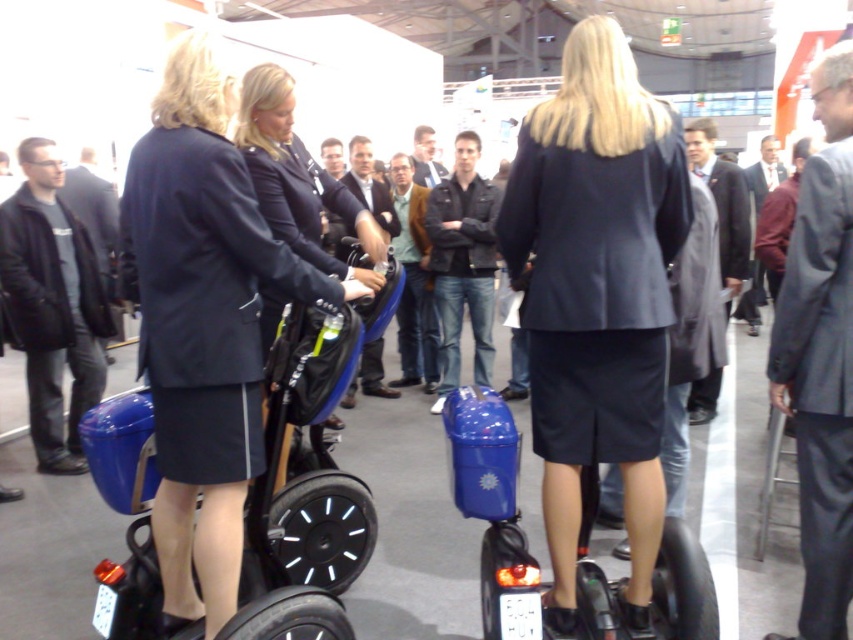
You are a photographer positioned in the front row of the exhibition hall. You want to take a photo that includes both the black matte jacket at left and the matte black segway at center. Which object should you focus on first to ensure both are in sharp focus?

The black matte jacket at left is closer to you than the matte black segway at center. To ensure both are in focus, focus on the black matte jacket at left first, as it is the closer object, and the segway will fall within the depth of field.

You are a delivery robot with a 30 inch wide package. You need to move from the blue matte scooter at center to the matte black jacket at center. Can you fit through the space between them?

The distance between the blue matte scooter at center and matte black jacket at center is 32.09 inches. Since your package is 30 inches wide, you can fit through the space between them.